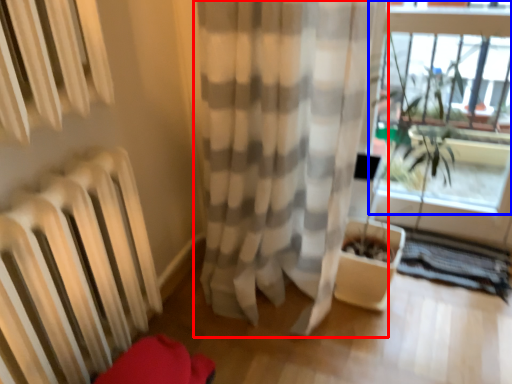
Question: Among these objects, which one is farthest to the camera, curtain (highlighted by a red box) or window frame (highlighted by a blue box)?

Choices:
 (A) curtain
 (B) window frame

Answer: (B)